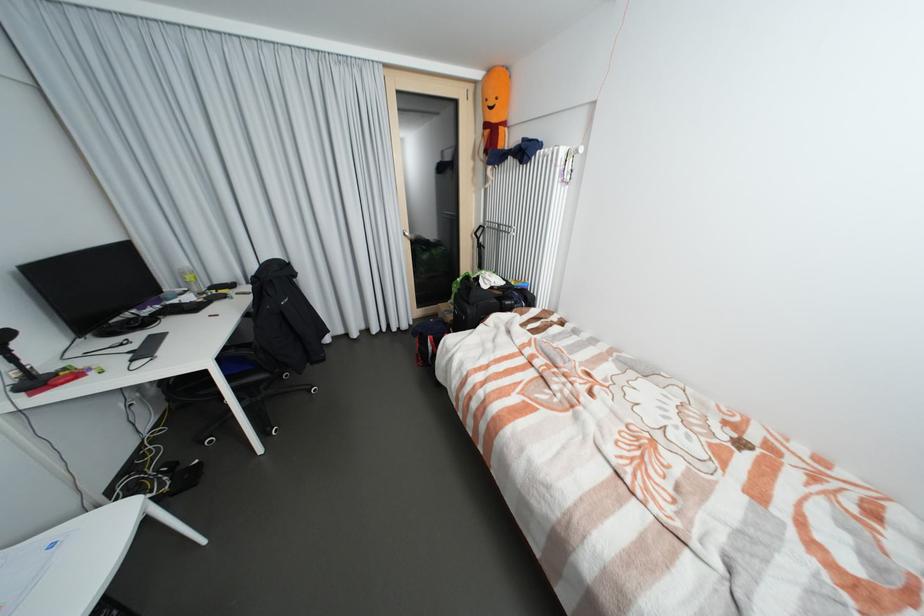
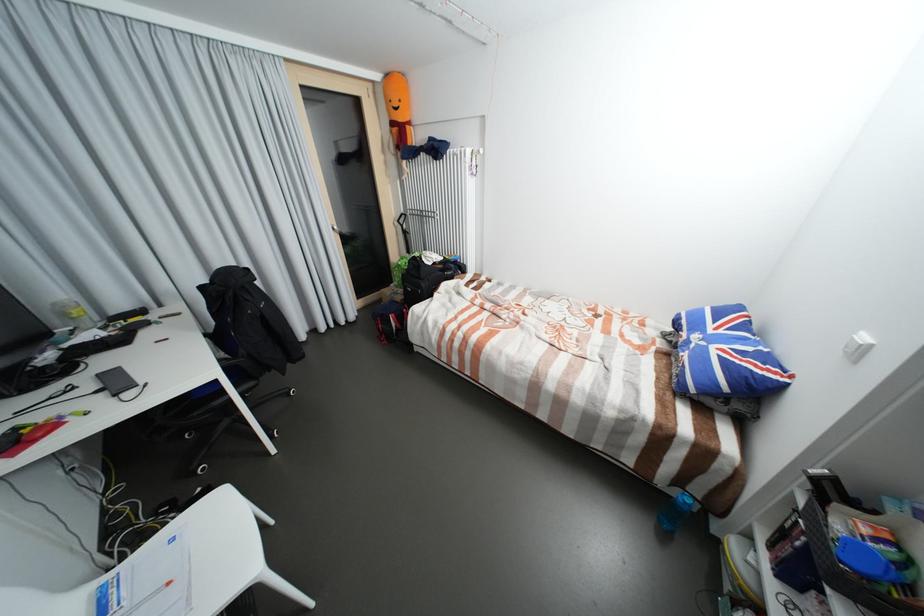
Looking at this image, what movement of the cameraman would produce the second image?

The movement direction of the cameraman is left, backward.